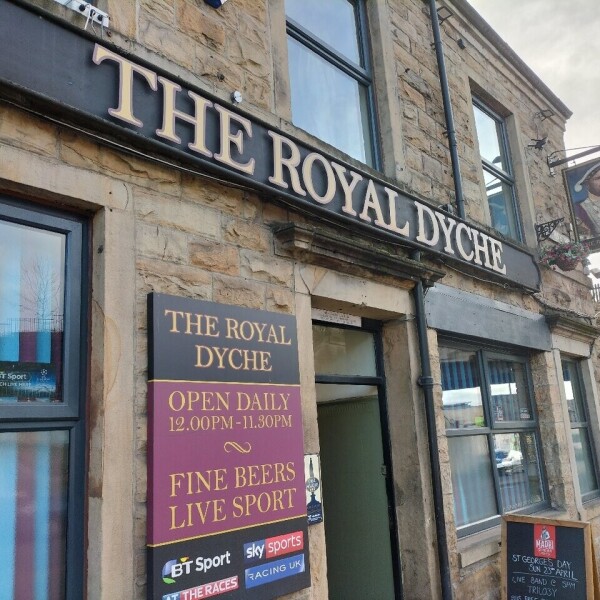
Where is `chalk sign board`? chalk sign board is located at coordinates (521, 539).